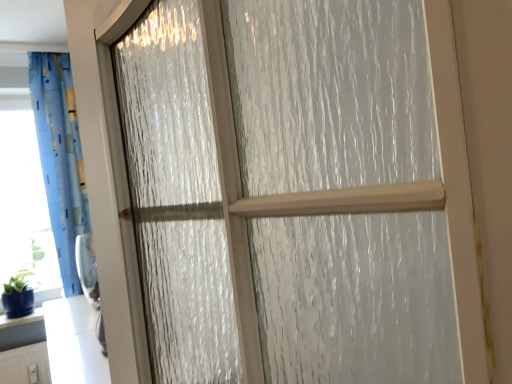
Question: Is blue fabric curtain at left looking in the opposite direction of blue glossy vase at lower left?

Choices:
 (A) no
 (B) yes

Answer: (A)

Question: Can you confirm if blue fabric curtain at left is positioned to the right of blue glossy vase at lower left?

Choices:
 (A) yes
 (B) no

Answer: (A)

Question: Considering the relative sizes of blue fabric curtain at left and blue glossy vase at lower left in the image provided, is blue fabric curtain at left bigger than blue glossy vase at lower left?

Choices:
 (A) no
 (B) yes

Answer: (B)

Question: Would you consider blue fabric curtain at left to be distant from blue glossy vase at lower left?

Choices:
 (A) yes
 (B) no

Answer: (B)

Question: Is blue fabric curtain at left taller than blue glossy vase at lower left?

Choices:
 (A) yes
 (B) no

Answer: (A)

Question: Does blue fabric curtain at left have a lesser width compared to blue glossy vase at lower left?

Choices:
 (A) no
 (B) yes

Answer: (A)

Question: Is transparent plastic window screen at left at the left side of blue glossy vase at lower left?

Choices:
 (A) yes
 (B) no

Answer: (A)

Question: Is transparent plastic window screen at left next to blue glossy vase at lower left?

Choices:
 (A) yes
 (B) no

Answer: (B)

Question: Is transparent plastic window screen at left closer to camera compared to blue glossy vase at lower left?

Choices:
 (A) no
 (B) yes

Answer: (A)

Question: Does transparent plastic window screen at left have a lesser width compared to blue glossy vase at lower left?

Choices:
 (A) no
 (B) yes

Answer: (B)

Question: Is transparent plastic window screen at left facing away from blue glossy vase at lower left?

Choices:
 (A) yes
 (B) no

Answer: (A)

Question: Can you confirm if transparent plastic window screen at left is smaller than blue glossy vase at lower left?

Choices:
 (A) yes
 (B) no

Answer: (B)

Question: Is transparent plastic window screen at left to the left of blue fabric curtain at left from the viewer's perspective?

Choices:
 (A) no
 (B) yes

Answer: (B)